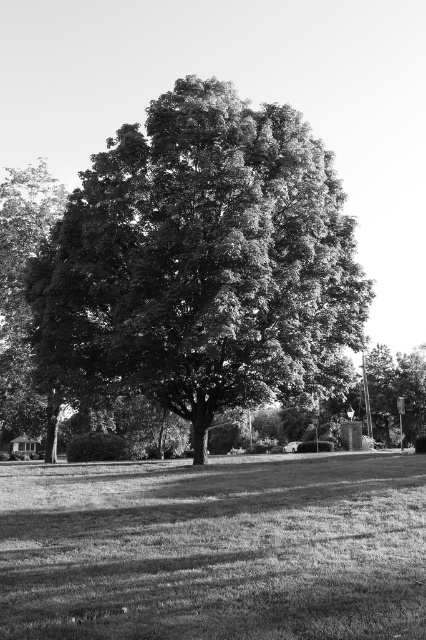
Question: Is dark green leafy oak tree at center smaller than grassy lawn at center?

Choices:
 (A) yes
 (B) no

Answer: (B)

Question: Which point is farther to the camera?

Choices:
 (A) (365, 483)
 (B) (138, 369)

Answer: (B)

Question: Can you confirm if dark green leafy oak tree at center is positioned above grassy lawn at center?

Choices:
 (A) yes
 (B) no

Answer: (A)

Question: Which point is farther to the camera?

Choices:
 (A) (206, 182)
 (B) (310, 474)

Answer: (A)

Question: Does dark green leafy oak tree at center have a lesser width compared to grassy lawn at center?

Choices:
 (A) no
 (B) yes

Answer: (A)